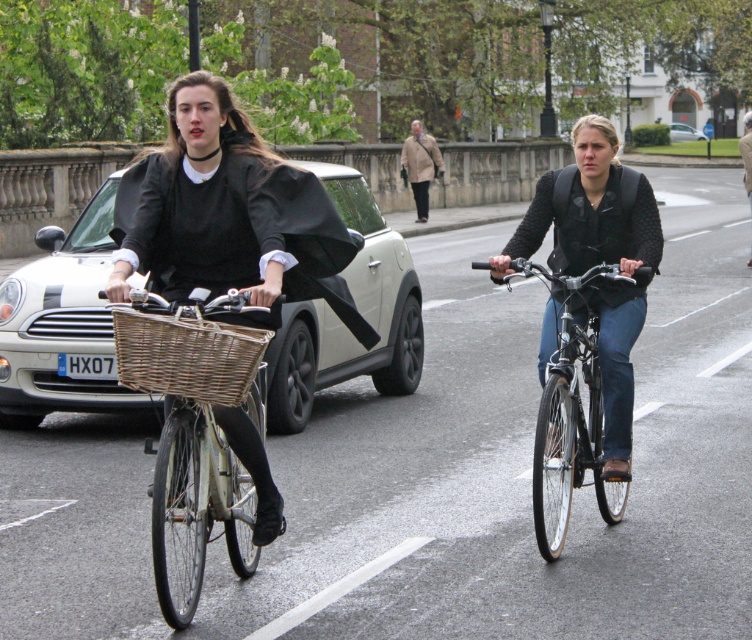
Question: Can you confirm if wooden wicker basket at left is positioned below white matte car at center?

Choices:
 (A) yes
 (B) no

Answer: (A)

Question: Based on their relative distances, which object is farther from the matte black bicycle at left?

Choices:
 (A) white fabric umbrella at upper center
 (B) woven brown basket at left

Answer: (A)

Question: Does matte wicker basket at center appear under matte black jacket at right?

Choices:
 (A) yes
 (B) no

Answer: (A)

Question: Which point is farther to the camera?

Choices:
 (A) (750, 168)
 (B) (602, 480)
 (C) (511, 257)

Answer: (A)

Question: Which object is positioned farthest from the white matte car at center?

Choices:
 (A) matte wicker basket at center
 (B) white plastic license plate at center
 (C) white matte car at left
 (D) matte black jacket at right

Answer: (D)

Question: Does matte wicker basket at center appear on the right side of white plastic license plate at center?

Choices:
 (A) no
 (B) yes

Answer: (B)